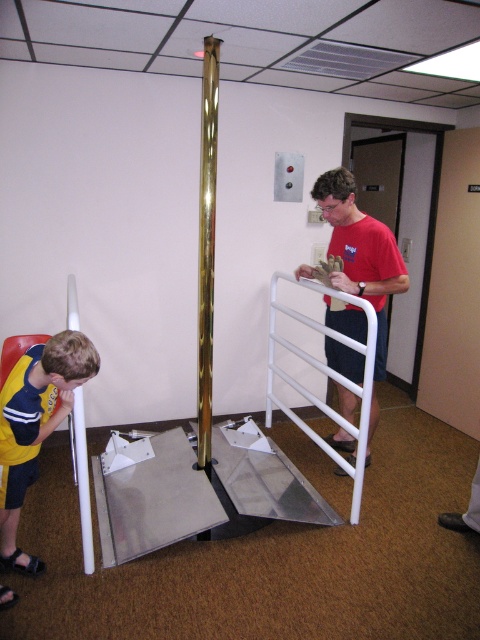
Question: Which point is farther to the camera?

Choices:
 (A) red t-shirt at center
 (B) yellow fabric shirt at lower left

Answer: (A)

Question: Can you confirm if red t-shirt at center is positioned to the right of yellow fabric shirt at lower left?

Choices:
 (A) no
 (B) yes

Answer: (B)

Question: Which object is farther from the camera taking this photo?

Choices:
 (A) red t-shirt at center
 (B) yellow fabric shirt at lower left
 (C) white matte rail at center

Answer: (A)

Question: Can you confirm if red t-shirt at center is bigger than yellow fabric shirt at lower left?

Choices:
 (A) yes
 (B) no

Answer: (A)

Question: Can you confirm if red t-shirt at center is bigger than white matte rail at center?

Choices:
 (A) yes
 (B) no

Answer: (B)

Question: Which of the following is the farthest from the observer?

Choices:
 (A) (349, 518)
 (B) (47, 353)

Answer: (A)